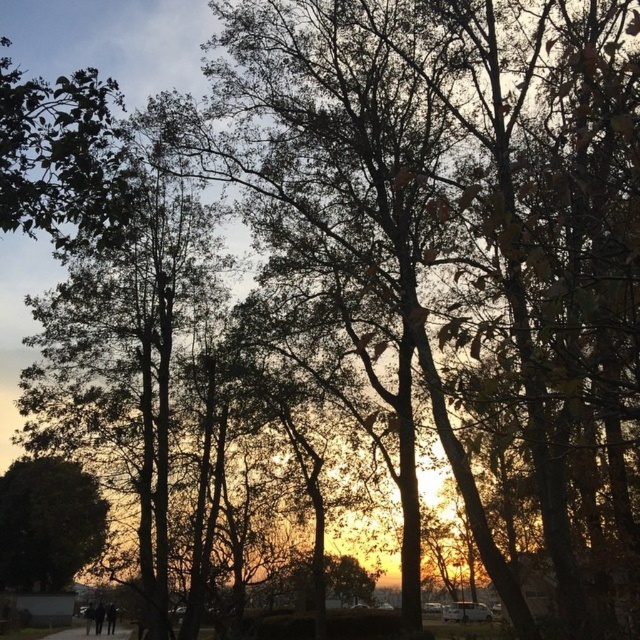
Is point (42, 198) closer to camera compared to point (49, 515)?

Yes, point (42, 198) is closer to viewer.

Is green leafy tree at upper left thinner than green leafy tree at lower left?

Yes.

The width and height of the screenshot is (640, 640). I want to click on green leafy tree at upper left, so click(61, 156).

Does green leafy tree at upper left have a greater width compared to gravel path at lower center?

Incorrect, green leafy tree at upper left's width does not surpass gravel path at lower center's.

This screenshot has width=640, height=640. Find the location of `green leafy tree at upper left`. green leafy tree at upper left is located at coordinates (61, 156).

Between green leafy tree at lower left and gravel path at lower center, which one is positioned lower?

gravel path at lower center is lower down.

Is point (72, 548) farther from camera compared to point (116, 628)?

No, it is not.

This screenshot has height=640, width=640. In order to click on green leafy tree at lower left in this screenshot , I will do `click(48, 524)`.